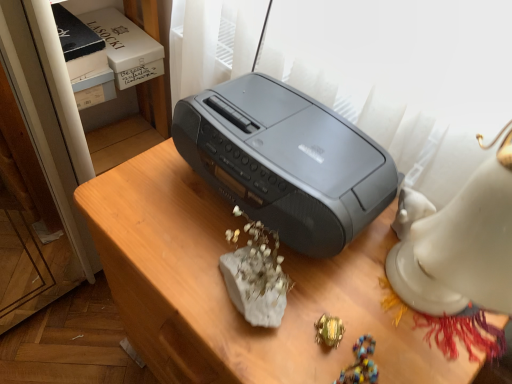
Question: From the image's perspective, is slate gray plastic printer at center above or below green metallic ring at lower center?

Choices:
 (A) above
 (B) below

Answer: (A)

Question: From a real-world perspective, relative to green metallic ring at lower center, is slate gray plastic printer at center vertically above or below?

Choices:
 (A) below
 (B) above

Answer: (B)

Question: Which of these objects is positioned farthest from the slate gray plastic printer at center?

Choices:
 (A) satin gray radio at center
 (B) green metallic ring at lower center

Answer: (B)

Question: Which of these objects is positioned closest to the slate gray plastic printer at center?

Choices:
 (A) satin gray radio at center
 (B) green metallic ring at lower center

Answer: (A)